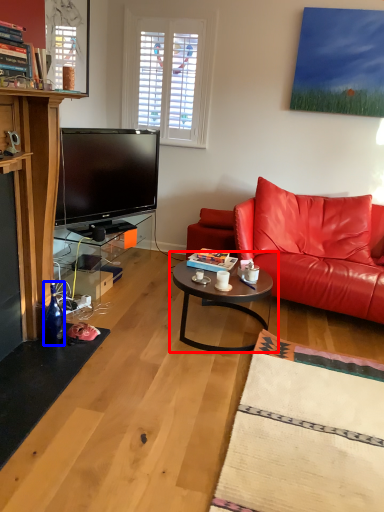
Question: Among these objects, which one is farthest to the camera, coffee table (highlighted by a red box) or bottle (highlighted by a blue box)?

Choices:
 (A) coffee table
 (B) bottle

Answer: (A)